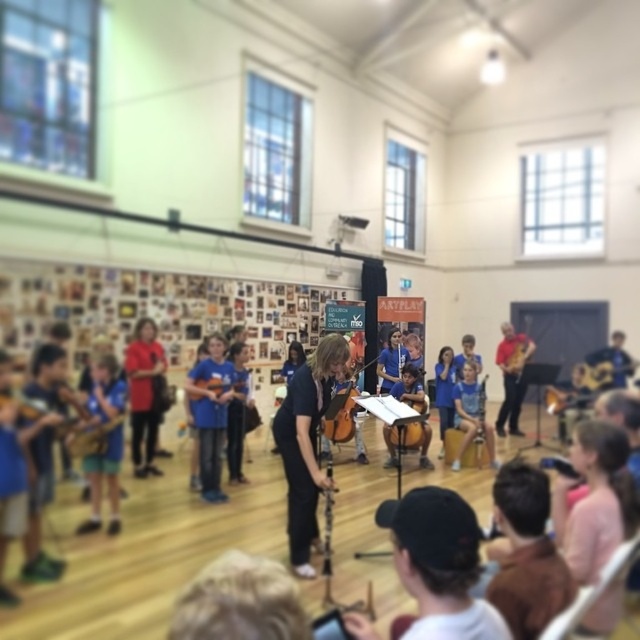
You are a student in the music class and need to retrieve the black matte clarinet at center for your next lesson. However, the wooden cello at center is blocking your path. Can you easily access the clarinet without moving the cello?

The black matte clarinet at center is positioned over the wooden cello at center, meaning it is placed on top of the cello. Therefore, you can easily access the clarinet without moving the cello by simply reaching over it.